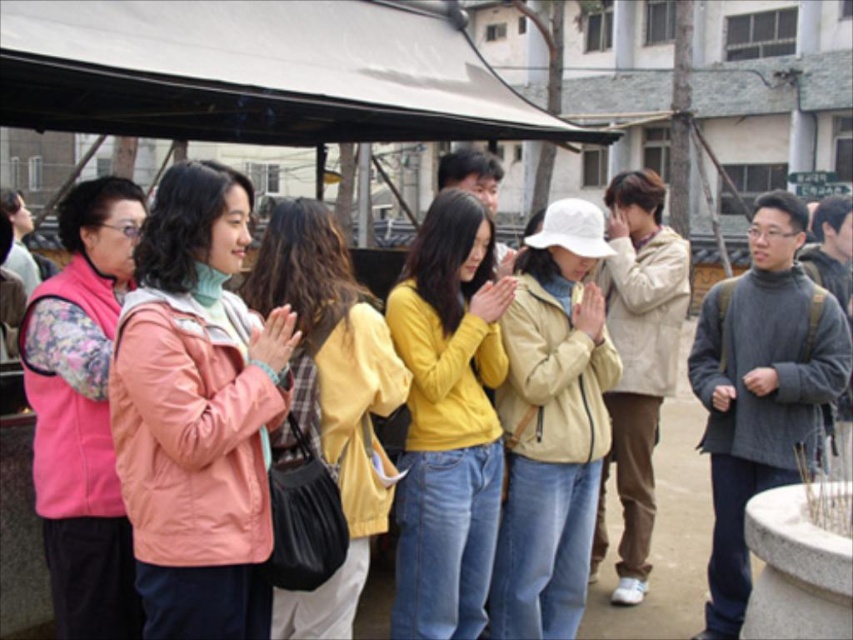
Is pink velvety vest at left taller than pink fabric jacket at center?

Yes, pink velvety vest at left is taller than pink fabric jacket at center.

Measure the distance between point (109, 524) and camera.

They are 3.82 meters apart.

Which is behind, point (70, 496) or point (347, 588)?

The point (347, 588) is behind.

The width and height of the screenshot is (853, 640). What are the coordinates of `pink velvety vest at left` in the screenshot? It's located at (83, 412).

In the scene shown: Which of these two, white matte canopy at upper center or peach matte jacket at center, stands shorter?

With less height is white matte canopy at upper center.

Is the position of white matte canopy at upper center less distant than that of peach matte jacket at center?

No, it is not.

Which is behind, point (158, 24) or point (187, 406)?

The point (158, 24) is more distant.

Find the location of a particular element. This screenshot has height=640, width=853. white matte canopy at upper center is located at coordinates (259, 72).

Can you confirm if white matte canopy at upper center is positioned above pink fabric jacket at center?

Correct, white matte canopy at upper center is located above pink fabric jacket at center.

Does white matte canopy at upper center have a lesser width compared to pink fabric jacket at center?

No, white matte canopy at upper center is not thinner than pink fabric jacket at center.

Is point (518, 100) positioned in front of point (317, 364)?

That is False.

In order to click on white matte canopy at upper center in this screenshot , I will do `click(259, 72)`.